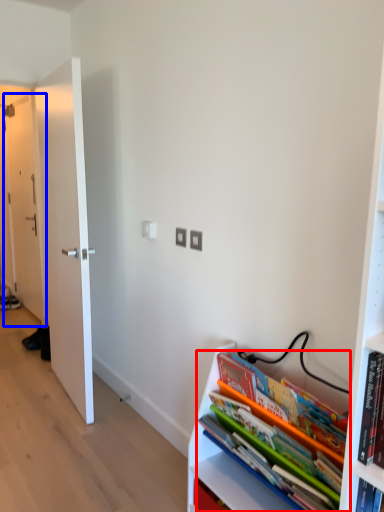
Question: Which of the following is the closest to the observer, book (highlighted by a red box) or door (highlighted by a blue box)?

Choices:
 (A) book
 (B) door

Answer: (A)